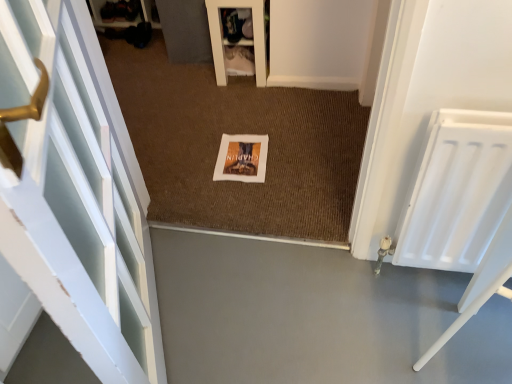
At what (x,y) coordinates should I click in order to perform the action: click on free space in front of white matte picture frame at center. Please return your answer as a coordinate pair (x, y). The width and height of the screenshot is (512, 384). Looking at the image, I should click on (245, 200).